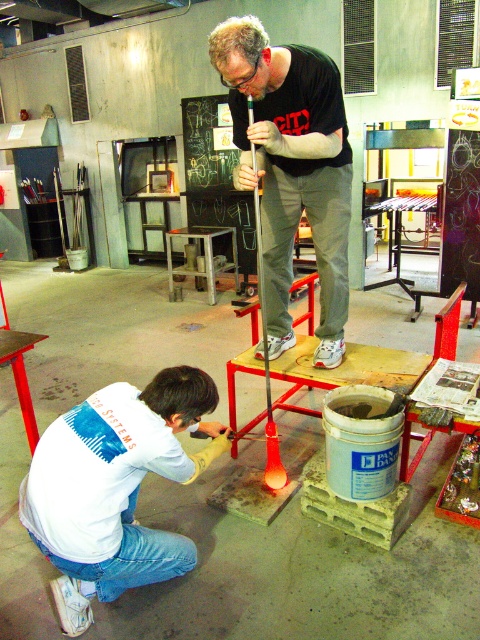
Question: Can you confirm if white matte shirt at lower left is bigger than matte black shirt at center?

Choices:
 (A) no
 (B) yes

Answer: (A)

Question: Is white matte shirt at lower left below matte black shirt at center?

Choices:
 (A) no
 (B) yes

Answer: (B)

Question: Which of these objects is positioned closest to the white matte shirt at lower left?

Choices:
 (A) matte black shirt at center
 (B) metallic stool at center

Answer: (A)

Question: Considering the real-world distances, which object is farthest from the metallic stool at center?

Choices:
 (A) white matte shirt at lower left
 (B) matte black shirt at center

Answer: (A)

Question: Which of the following is the farthest from the observer?

Choices:
 (A) (323, 216)
 (B) (205, 253)

Answer: (B)

Question: Does matte black shirt at center have a larger size compared to metallic stool at center?

Choices:
 (A) no
 (B) yes

Answer: (B)